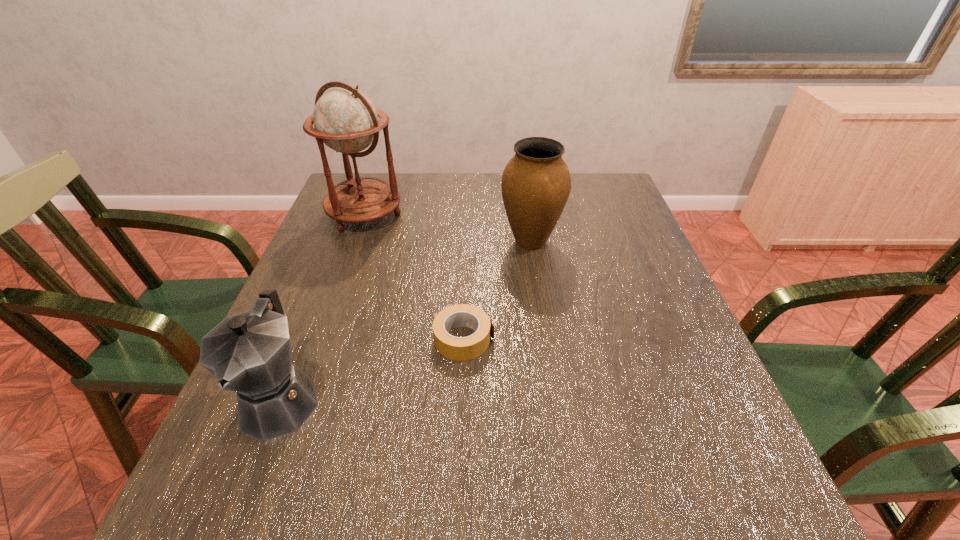
The height and width of the screenshot is (540, 960). I want to click on globe, so click(345, 120).

Identify the location of the third shortest object. (536, 183).

Find the location of a particular element. urn is located at coordinates (536, 183).

Identify the location of the second shortest object. (249, 353).

At what (x,y) coordinates should I click in order to perform the action: click on the shortest object. Please return your answer as a coordinate pair (x, y). Looking at the image, I should click on (467, 348).

Where is `duct tape`? duct tape is located at coordinates (467, 348).

Where is `vacant space situated 0.080m on the surface of the tallest object`? This screenshot has width=960, height=540. vacant space situated 0.080m on the surface of the tallest object is located at coordinates [x=350, y=255].

Locate an element on the screen. The image size is (960, 540). free space located on the right of the rightmost object is located at coordinates (645, 241).

Where is `free space located 0.120m at the spout of the third tallest object`? This screenshot has width=960, height=540. free space located 0.120m at the spout of the third tallest object is located at coordinates (229, 531).

Identify the location of free space located at the edge of the duct tape. (566, 339).